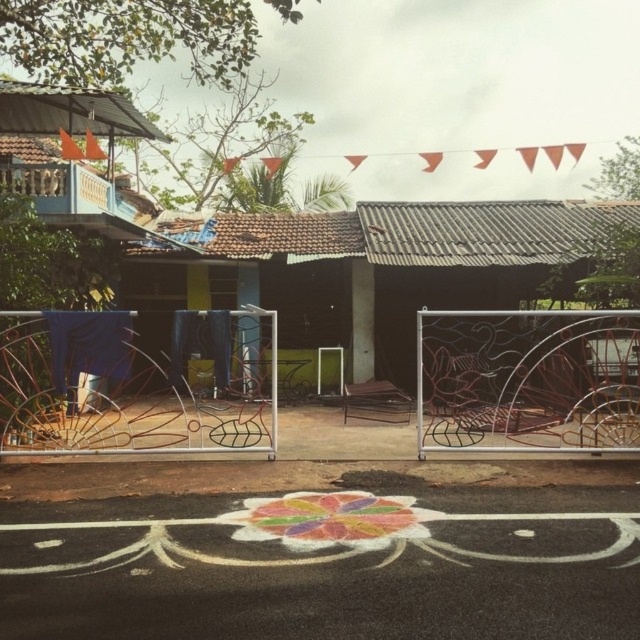
Question: Does blue painted wood hut at left appear on the left side of wooden chair at center?

Choices:
 (A) no
 (B) yes

Answer: (B)

Question: Does brown corrugated metal hut at center have a lesser width compared to blue painted wood hut at left?

Choices:
 (A) no
 (B) yes

Answer: (A)

Question: Which object is the closest to the blue painted wood hut at left?

Choices:
 (A) brown corrugated metal hut at center
 (B) wooden chair at center

Answer: (A)

Question: Where is brown corrugated metal hut at center located in relation to blue painted wood hut at left in the image?

Choices:
 (A) above
 (B) below

Answer: (B)

Question: Which object is farther from the camera taking this photo?

Choices:
 (A) brown corrugated metal hut at center
 (B) wooden chair at center
 (C) blue painted wood hut at left

Answer: (A)

Question: Which object appears closest to the camera in this image?

Choices:
 (A) blue painted wood hut at left
 (B) brown corrugated metal hut at center

Answer: (A)